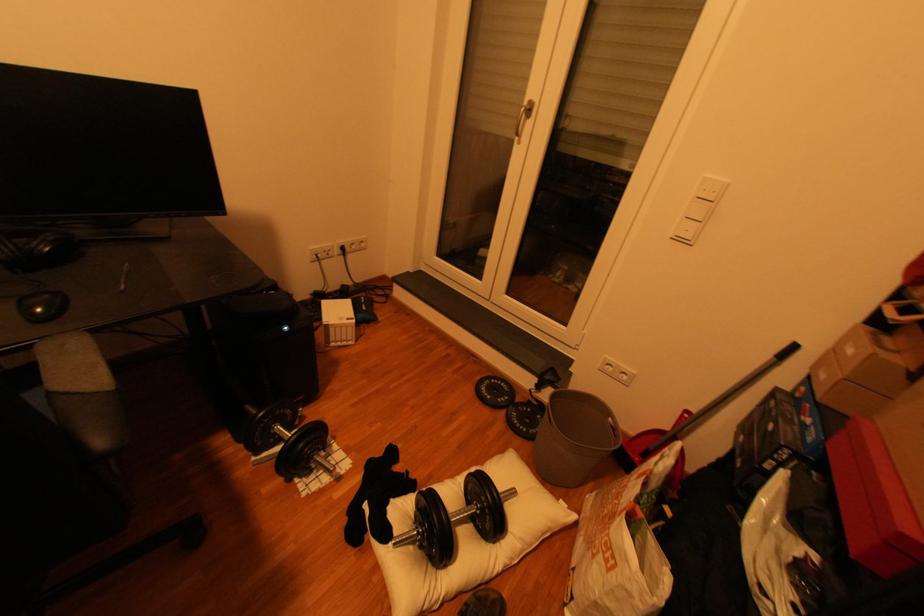
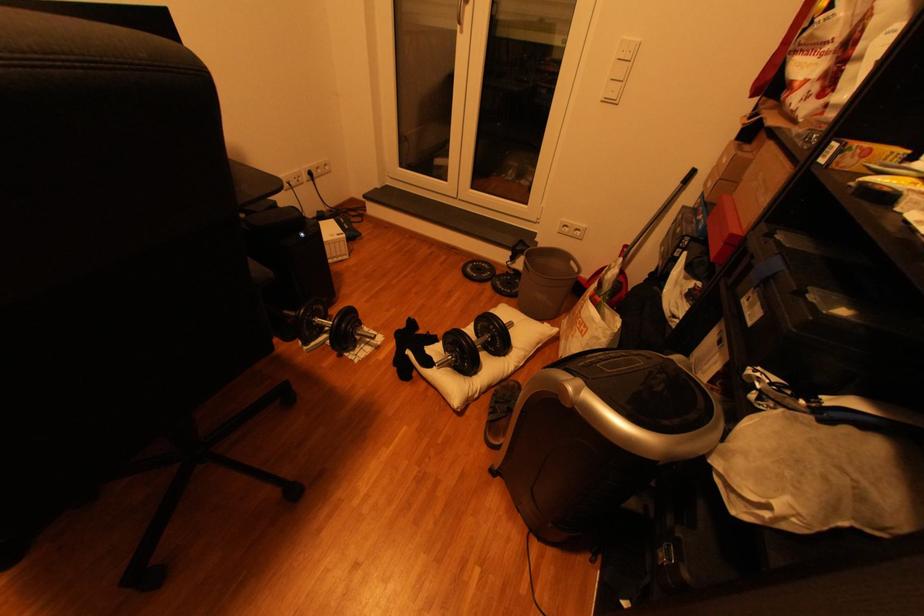
In a continuous first-person perspective shot, in which direction is the camera moving?

The cameraman walked toward left, backward.